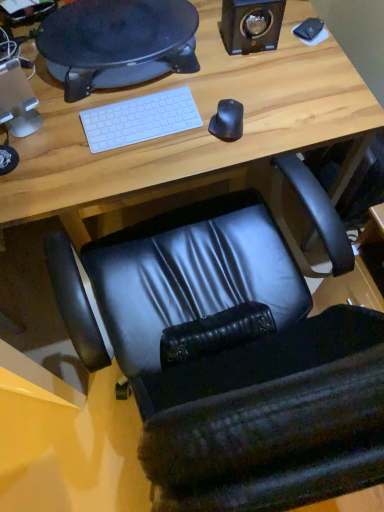
You are a GUI agent. You are given a task and a screenshot of the screen. Output one action in this format:
    pyautogui.click(x=<x>, y=<y>)
    Task: Click on the vacant space to the right of matte black desk at upper center
    
    Given the screenshot: What is the action you would take?
    pyautogui.click(x=259, y=86)